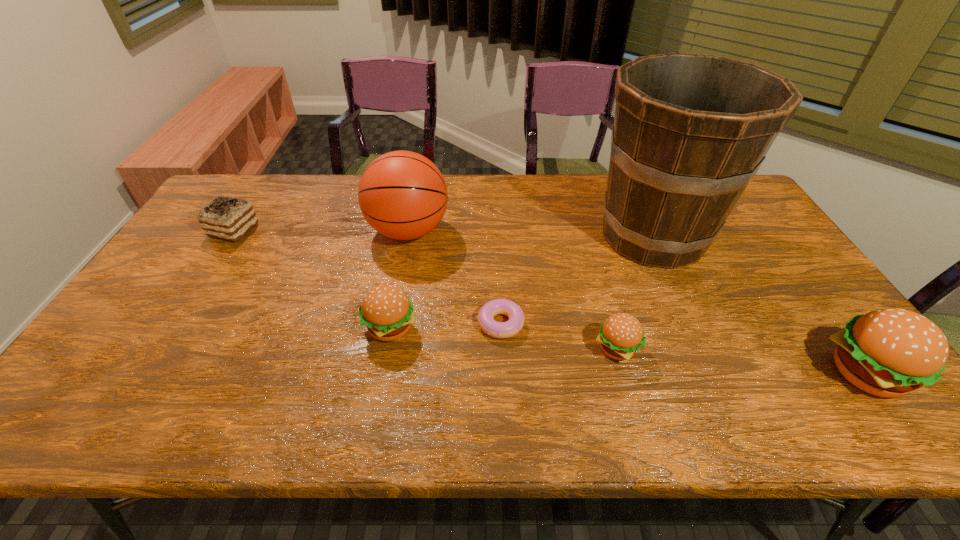
The height and width of the screenshot is (540, 960). Identify the location of vacant space located 0.110m on the back of the leftmost hamburger. (398, 278).

Identify the location of vacant area located 0.240m on the right of the shortest hamburger. This screenshot has height=540, width=960. (737, 349).

I want to click on free space located 0.330m on the back of the rightmost object, so click(x=777, y=254).

At what (x,y) coordinates should I click in order to perform the action: click on free space located 0.080m on the right of the chocolate cake. Please return your answer as a coordinate pair (x, y). Looking at the image, I should click on (281, 230).

This screenshot has height=540, width=960. Find the location of `free space located on the right of the tallest object`. free space located on the right of the tallest object is located at coordinates (753, 235).

Identify the location of free space located on the right of the sixth shortest object. Image resolution: width=960 pixels, height=540 pixels. (531, 231).

The height and width of the screenshot is (540, 960). What are the coordinates of `blank area located 0.390m on the back of the shortest object` in the screenshot? It's located at (496, 219).

Where is `bucket situated at the far edge`? This screenshot has width=960, height=540. bucket situated at the far edge is located at coordinates (690, 131).

The width and height of the screenshot is (960, 540). Identify the location of basketball located in the far edge section of the desktop. point(403,195).

Where is `object situated at the left edge`? object situated at the left edge is located at coordinates (227, 218).